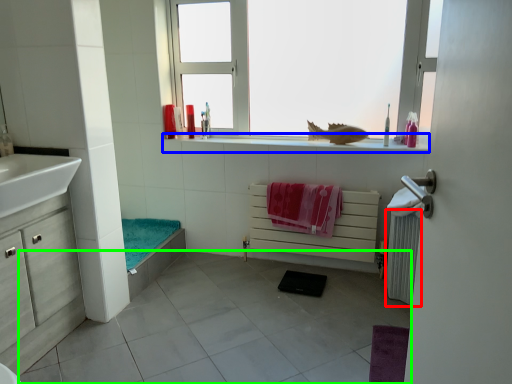
Question: Based on their relative distances, which object is nearer to radiator (highlighted by a red box)? Choose from window sill (highlighted by a blue box) and tile (highlighted by a green box).

Choices:
 (A) window sill
 (B) tile

Answer: (A)